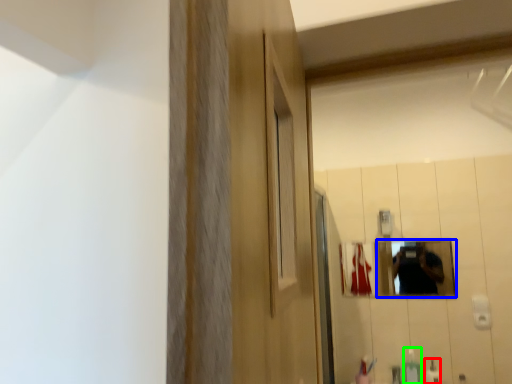
Question: Estimate the real-world distances between objects in this image. Which object is farther from mouthwash (highlighted by a red box), mirror (highlighted by a blue box) or soap dispenser (highlighted by a green box)?

Choices:
 (A) mirror
 (B) soap dispenser

Answer: (A)